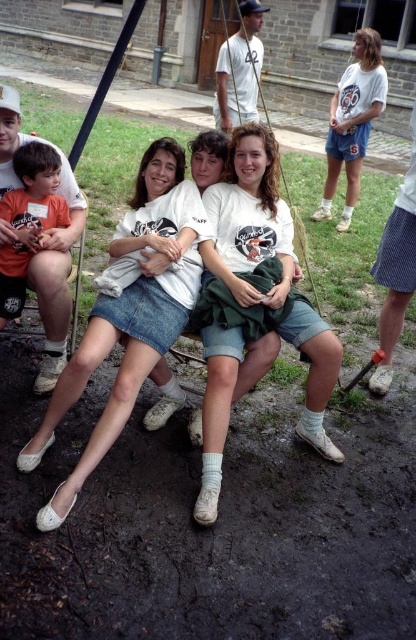
Is white cotton shirt at center taller than orange cotton shirt at left?

Correct, white cotton shirt at center is much taller as orange cotton shirt at left.

Is point (304, 404) positioned after point (12, 310)?

No, (304, 404) is in front of (12, 310).

Who is more distant from viewer, (x=309, y=413) or (x=17, y=214)?

Point (x=17, y=214)

Locate an element on the screen. white cotton shirt at center is located at coordinates (250, 218).

From the picture: Which is below, denim skirt at center or orange cotton shirt at left?

denim skirt at center

The height and width of the screenshot is (640, 416). Describe the element at coordinates (128, 317) in the screenshot. I see `denim skirt at center` at that location.

Where is `denim skirt at center`? The width and height of the screenshot is (416, 640). denim skirt at center is located at coordinates (128, 317).

Locate an element on the screen. denim skirt at center is located at coordinates 128,317.

Does point (195, 205) come farther from viewer compared to point (242, 205)?

That is False.

Does point (133, 262) come closer to viewer compared to point (217, 364)?

That is False.

Where is `denim skirt at center`? denim skirt at center is located at coordinates pos(128,317).